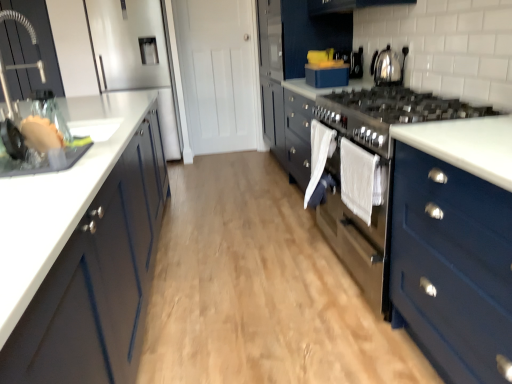
Question: Which direction should I rotate to look at white cotton towel at center, which ranks as the 1th clothe in front-to-back order, — up or down?

Choices:
 (A) down
 (B) up

Answer: (B)

Question: From a real-world perspective, is white fabric towel at center, which is the 2th clothe in front-to-back order, over white cotton towel at center, which ranks as the 1th clothe in front-to-back order?

Choices:
 (A) no
 (B) yes

Answer: (A)

Question: From the image's perspective, is white fabric towel at center, which is the 2th clothe in front-to-back order, located above white cotton towel at center, marked as the 2th clothe in a back-to-front arrangement?

Choices:
 (A) yes
 (B) no

Answer: (A)

Question: Is white fabric towel at center, which is the 2th clothe in front-to-back order, bigger than white cotton towel at center, marked as the 2th clothe in a back-to-front arrangement?

Choices:
 (A) yes
 (B) no

Answer: (A)

Question: Does white fabric towel at center, which is the 2th clothe in front-to-back order, have a greater height compared to white cotton towel at center, which ranks as the 1th clothe in front-to-back order?

Choices:
 (A) yes
 (B) no

Answer: (A)

Question: Is white fabric towel at center, which is counted as the first clothe, starting from the back, oriented away from white cotton towel at center, marked as the 2th clothe in a back-to-front arrangement?

Choices:
 (A) no
 (B) yes

Answer: (A)

Question: Does white fabric towel at center, which is counted as the first clothe, starting from the back, come in front of white cotton towel at center, marked as the 2th clothe in a back-to-front arrangement?

Choices:
 (A) no
 (B) yes

Answer: (A)

Question: Is wooden floor at center placed right next to brushed metal faucet at left, the second cabinetry from the right?

Choices:
 (A) no
 (B) yes

Answer: (A)

Question: Is wooden floor at center positioned with its back to brushed metal faucet at left, which is the 2th cabinetry from left to right?

Choices:
 (A) yes
 (B) no

Answer: (B)

Question: From the image's perspective, would you say wooden floor at center is positioned over brushed metal faucet at left, the second cabinetry from the right?

Choices:
 (A) no
 (B) yes

Answer: (A)

Question: Considering the relative positions of wooden floor at center and brushed metal faucet at left, which is the 2th cabinetry from left to right, in the image provided, is wooden floor at center in front of brushed metal faucet at left, which is the 2th cabinetry from left to right,?

Choices:
 (A) yes
 (B) no

Answer: (A)

Question: Can you confirm if wooden floor at center is positioned to the right of brushed metal faucet at left, which is the 2th cabinetry from left to right?

Choices:
 (A) yes
 (B) no

Answer: (A)

Question: Does wooden floor at center appear on the left side of brushed metal faucet at left, the second cabinetry from the right?

Choices:
 (A) no
 (B) yes

Answer: (A)

Question: Is matte blue dresser at center located within brushed metal faucet at left, the second cabinetry from the right?

Choices:
 (A) yes
 (B) no

Answer: (B)